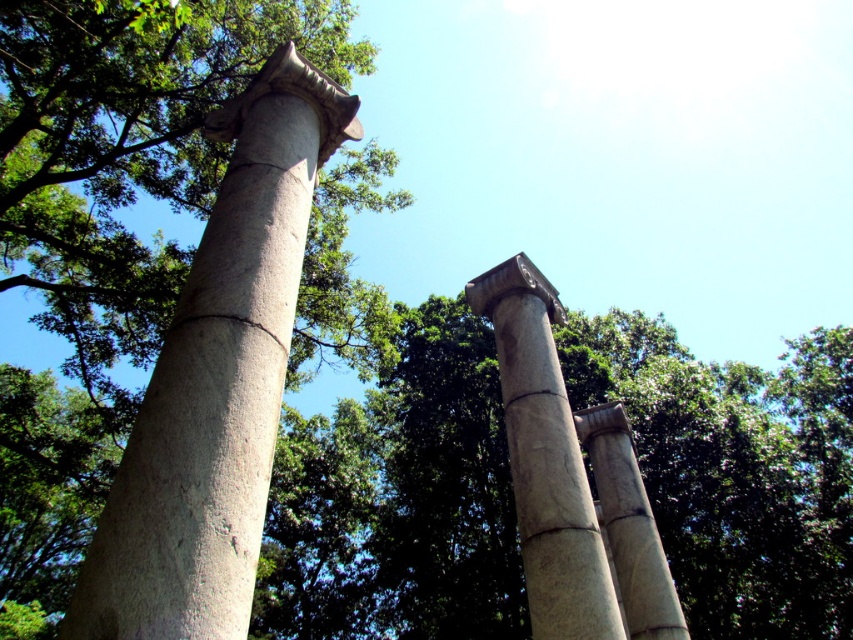
You are an architect assessing the structural integrity of the columns in the scene. Given that the smooth gray column at left and the gray stone column at center must support a heavy stone beam, which column would you recommend placing the beam on top of to ensure stability?

The smooth gray column at left has a greater height compared to gray stone column at center. Since taller columns provide a more stable base for heavy beams due to their increased surface area and structural support, the beam should be placed on top of the smooth gray column at left.

You are an architect designing a new garden pathway. You need to place a decorative statue between the white stone column at center and the gray stone column at center. Which column should the statue be closer to if it needs to be placed closer to the smaller column?

The statue should be placed closer to the white stone column at center because it is smaller than the gray stone column at center.